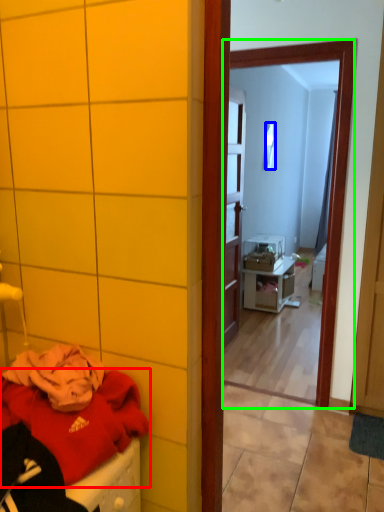
Question: Which object is positioned farthest from clothing (highlighted by a red box)? Select from mirror (highlighted by a blue box) and mirror (highlighted by a green box).

Choices:
 (A) mirror
 (B) mirror

Answer: (A)